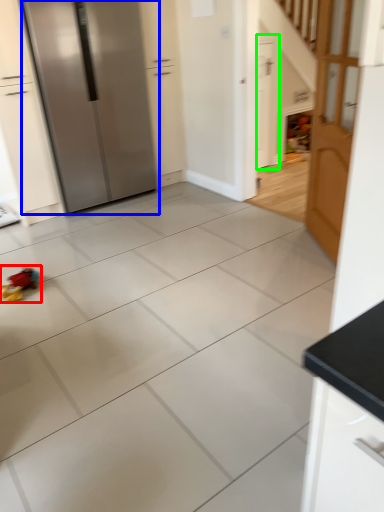
Question: Which is nearer to the toy (highlighted by a red box)? refrigerator (highlighted by a blue box) or door (highlighted by a green box).

Choices:
 (A) refrigerator
 (B) door

Answer: (A)